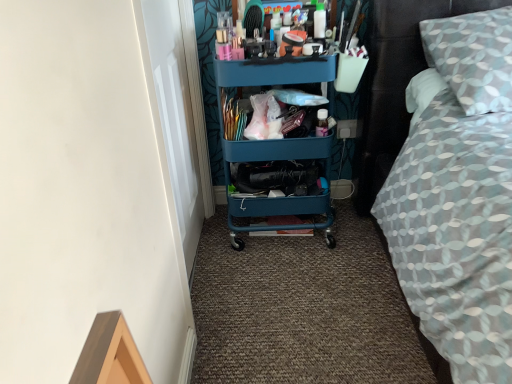
Where is `vacant area in front of teal plastic cart at center`? vacant area in front of teal plastic cart at center is located at coordinates (289, 283).